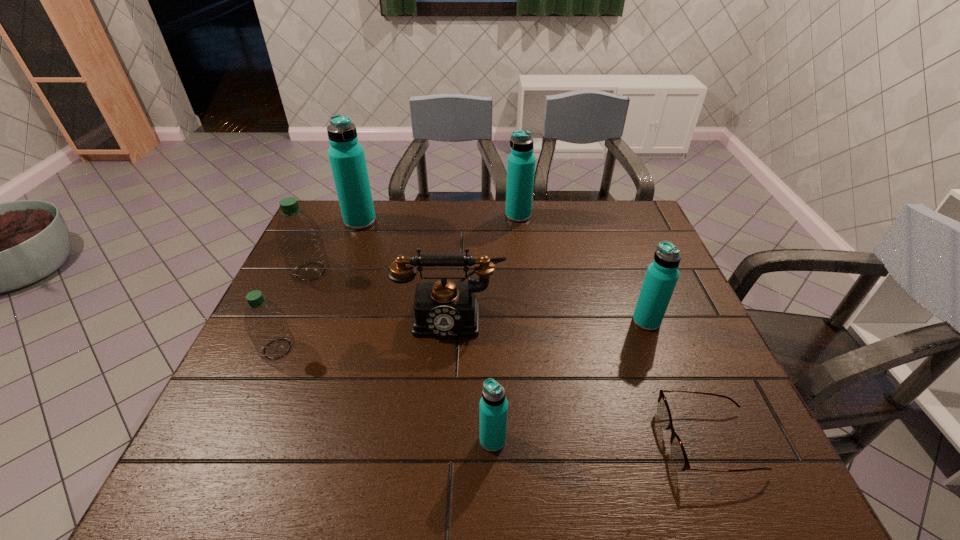
Find the location of a particular element. The width and height of the screenshot is (960, 540). the nearest water bottle is located at coordinates (493, 408).

This screenshot has height=540, width=960. I want to click on the nearer green water bottle, so click(x=265, y=323).

Where is `the second nearest water bottle`? Image resolution: width=960 pixels, height=540 pixels. the second nearest water bottle is located at coordinates (265, 323).

Image resolution: width=960 pixels, height=540 pixels. Find the location of `spectacles`. spectacles is located at coordinates (678, 453).

This screenshot has height=540, width=960. I want to click on free region located on the right of the tallest water bottle, so point(450,221).

Locate an element on the screen. This screenshot has height=540, width=960. free space located on the right of the sixth object from left to right is located at coordinates (601, 215).

The height and width of the screenshot is (540, 960). What are the coordinates of `vacant space situated 0.350m on the back of the third nearest water bottle` in the screenshot? It's located at (612, 235).

Where is `free location located on the right of the third farthest water bottle`? The height and width of the screenshot is (540, 960). free location located on the right of the third farthest water bottle is located at coordinates (436, 272).

Identify the location of vacant position located 0.180m on the front of the telephone at the rotary dial. The width and height of the screenshot is (960, 540). (444, 404).

This screenshot has width=960, height=540. Find the location of `blank space located on the back of the smallest blue water bottle`. blank space located on the back of the smallest blue water bottle is located at coordinates (492, 388).